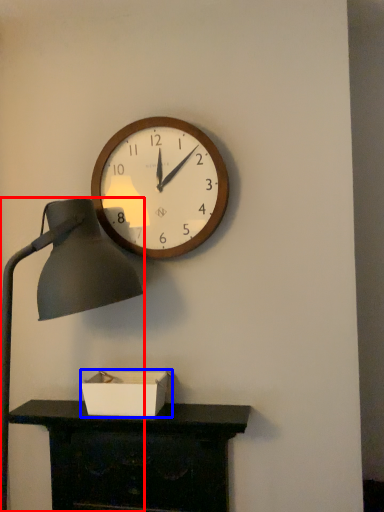
Question: Which object is closer to the camera taking this photo, lamp (highlighted by a red box) or box (highlighted by a blue box)?

Choices:
 (A) lamp
 (B) box

Answer: (A)